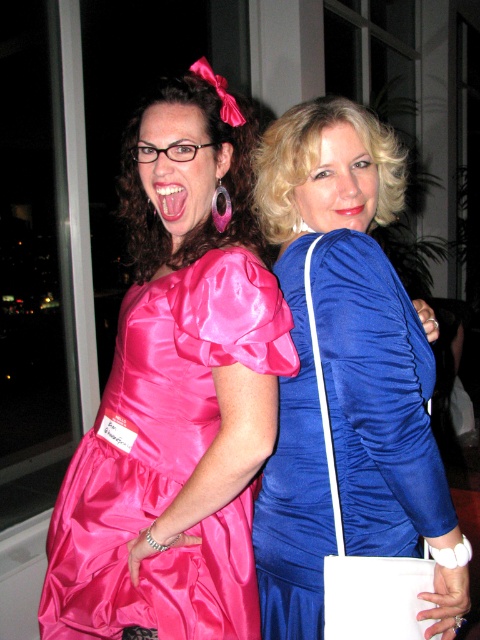
Does blue satin dress at center have a larger size compared to shiny pink satin dress at center?

Yes.

The width and height of the screenshot is (480, 640). Identify the location of blue satin dress at center. (347, 374).